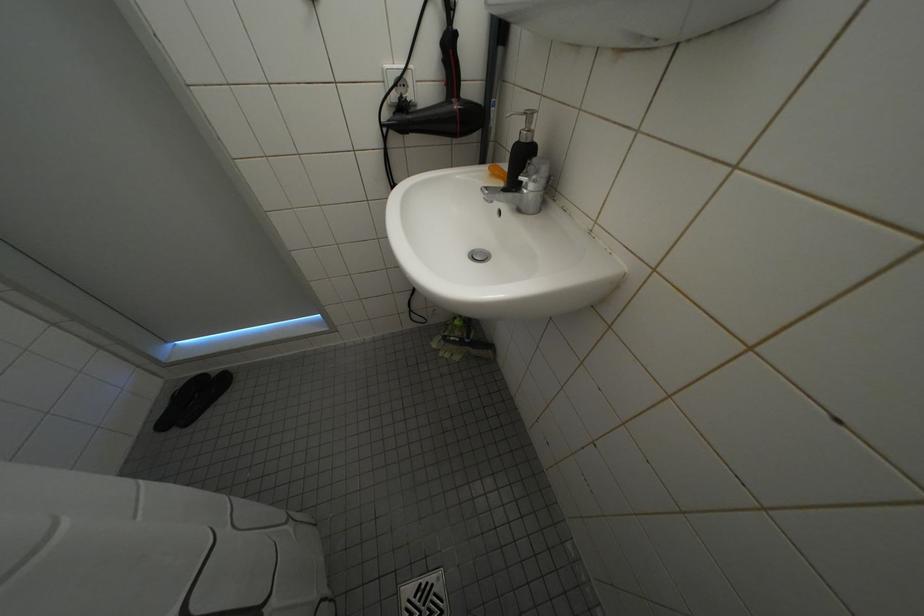
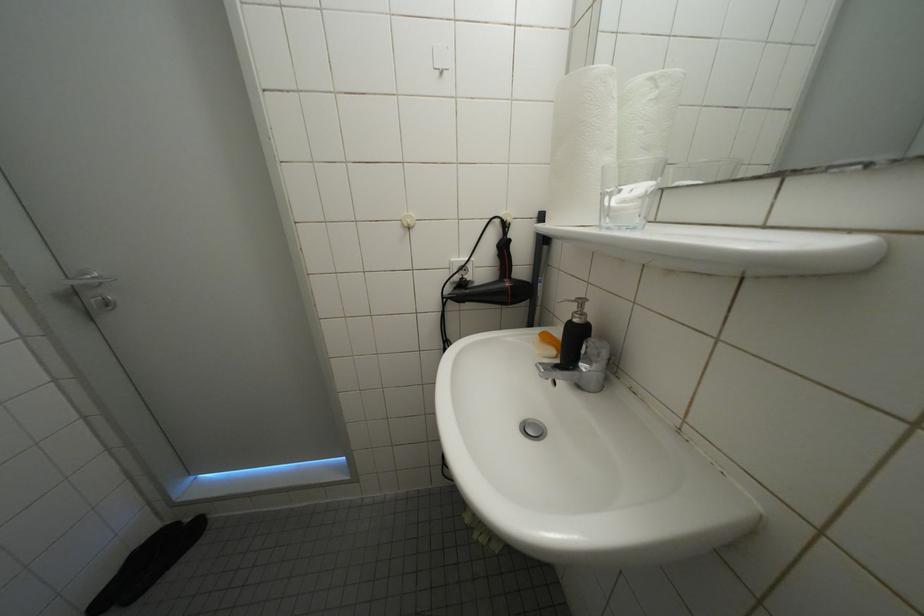
Question: The images are taken continuously from a first-person perspective. In which direction is your viewpoint rotating?

Choices:
 (A) Left
 (B) Right
 (C) Up
 (D) Down

Answer: (C)